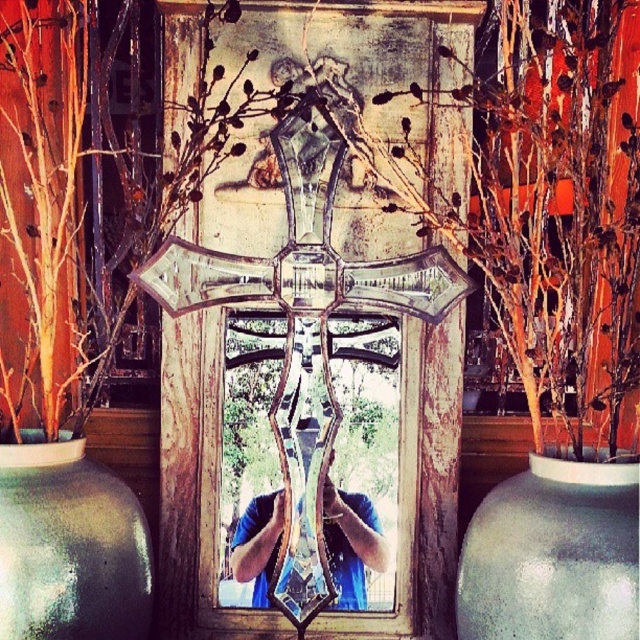
From the picture: How far apart are shiny glass cross at center and matte gray vase at lower left?

A distance of 11.39 inches exists between shiny glass cross at center and matte gray vase at lower left.

What do you see at coordinates (305, 352) in the screenshot? The height and width of the screenshot is (640, 640). I see `shiny glass cross at center` at bounding box center [305, 352].

At what (x,y) coordinates should I click in order to perform the action: click on shiny glass cross at center. Please return your answer as a coordinate pair (x, y). Looking at the image, I should click on (305, 352).

In the scene shown: Which of these two, shiny glass cross at center or matte gray vase at center, stands taller?

shiny glass cross at center

Consider the image. Who is shorter, shiny glass cross at center or matte gray vase at center?

matte gray vase at center

Is point (264, 282) less distant than point (481, 605)?

No, it is behind (481, 605).

Find the location of a particular element. The width and height of the screenshot is (640, 640). shiny glass cross at center is located at coordinates (305, 352).

Is matte gray vase at center to the right of matte gray vase at lower left from the viewer's perspective?

Correct, you'll find matte gray vase at center to the right of matte gray vase at lower left.

Who is shorter, matte gray vase at center or matte gray vase at lower left?

With less height is matte gray vase at center.

Is point (506, 512) positioned in front of point (104, 566)?

No, it is not.

Find the location of a particular element. The width and height of the screenshot is (640, 640). matte gray vase at center is located at coordinates (552, 554).